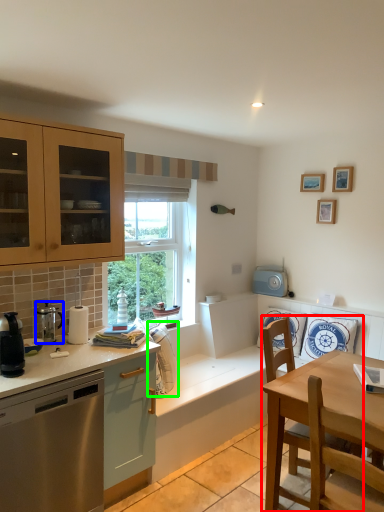
Question: Which object is positioned farthest from chair (highlighted by a red box)? Select from kitchen appliance (highlighted by a blue box) and appliance (highlighted by a green box).

Choices:
 (A) kitchen appliance
 (B) appliance

Answer: (A)